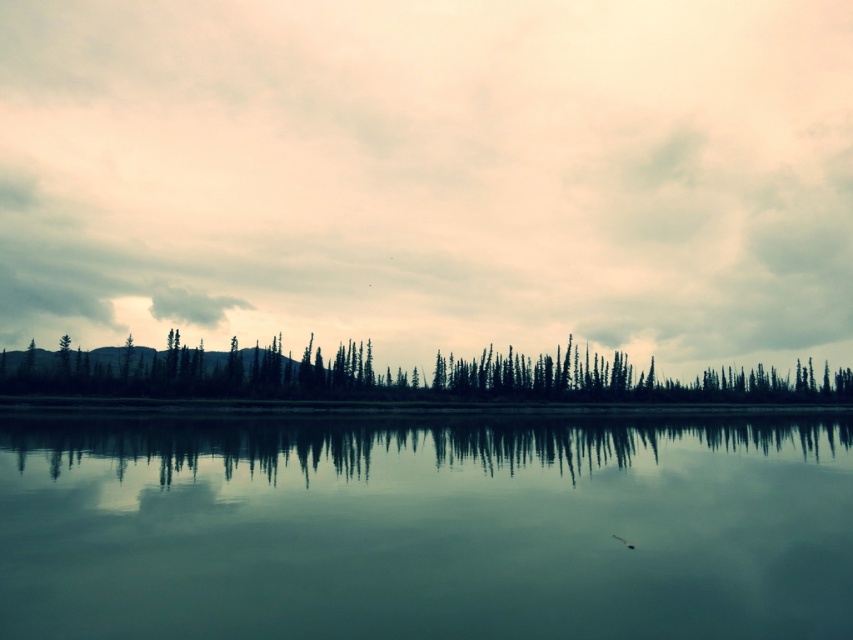
Question: Which point is closer to the camera?

Choices:
 (A) smooth glass water at center
 (B) dark green textured trees at center

Answer: (A)

Question: Is smooth glass water at center to the right of dark green textured trees at center from the viewer's perspective?

Choices:
 (A) yes
 (B) no

Answer: (B)

Question: Which point is farther to the camera?

Choices:
 (A) (173, 618)
 (B) (654, 397)

Answer: (B)

Question: Among these points, which one is nearest to the camera?

Choices:
 (A) (56, 362)
 (B) (198, 470)

Answer: (B)

Question: Does smooth glass water at center appear over dark green textured trees at center?

Choices:
 (A) no
 (B) yes

Answer: (A)

Question: Does cloudy sky at upper center have a larger size compared to dark green textured trees at center?

Choices:
 (A) no
 (B) yes

Answer: (B)